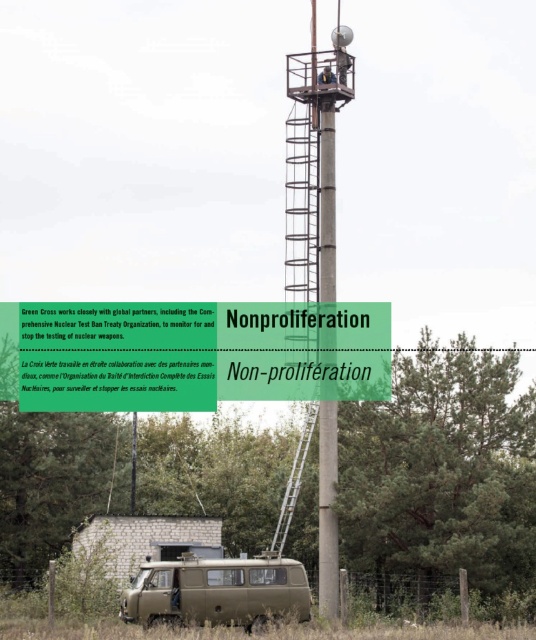
Question: Estimate the real-world distances between objects in this image. Which object is closer to the matte olive green van at lower center?

Choices:
 (A) metallic silver ladder at center
 (B) gray concrete tower at center
 (C) green paper non-proliferation sign at upper center
 (D) concrete pole at center

Answer: (A)

Question: Does matte olive green van at lower center have a greater width compared to metallic silver ladder at center?

Choices:
 (A) yes
 (B) no

Answer: (A)

Question: Can you confirm if matte olive green van at lower center is bigger than concrete pole at center?

Choices:
 (A) no
 (B) yes

Answer: (A)

Question: Considering the real-world distances, which object is farthest from the metallic silver ladder at center?

Choices:
 (A) concrete pole at center
 (B) matte olive green van at lower center
 (C) green paper non-proliferation sign at upper center

Answer: (C)

Question: Which object is farther from the camera taking this photo?

Choices:
 (A) green paper non-proliferation sign at upper center
 (B) concrete pole at center

Answer: (A)

Question: Is matte olive green van at lower center further to camera compared to metallic silver ladder at center?

Choices:
 (A) yes
 (B) no

Answer: (B)